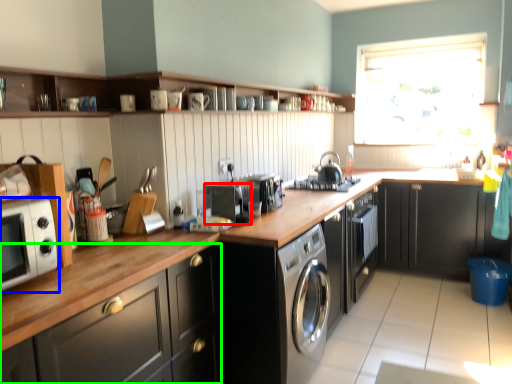
Question: Which object is positioned closest to appliance (highlighted by a red box)? Select from home appliance (highlighted by a blue box) and cabinetry (highlighted by a green box).

Choices:
 (A) home appliance
 (B) cabinetry

Answer: (B)